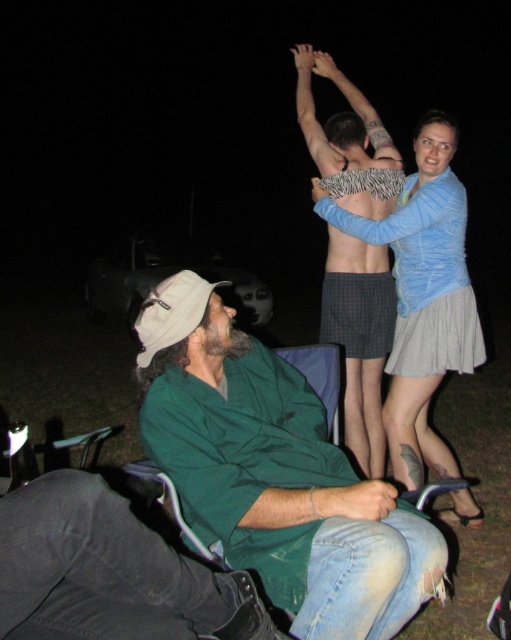
Measure the distance between green cotton shirt at lower left and camera.

They are 5.44 feet apart.

You are a GUI agent. You are given a task and a screenshot of the screen. Output one action in this format:
    pyautogui.click(x=<x>, y=<y>)
    Task: Click on the green cotton shirt at lower left
    This screenshot has height=640, width=511.
    Given the screenshot: What is the action you would take?
    pyautogui.click(x=274, y=474)

Does point (259, 397) come closer to viewer compared to point (352, 218)?

Yes, point (259, 397) is closer to viewer.

Image resolution: width=511 pixels, height=640 pixels. In order to click on green cotton shirt at lower left in this screenshot , I will do `click(274, 474)`.

Is green cotton shirt at lower left in front of zebra-patterned fabric at center?

Yes, green cotton shirt at lower left is closer to the viewer.

Is green cotton shirt at lower left smaller than zebra-patterned fabric at center?

No.

You are a GUI agent. You are given a task and a screenshot of the screen. Output one action in this format:
    pyautogui.click(x=<x>, y=<y>)
    Task: Click on the green cotton shirt at lower left
    
    Given the screenshot: What is the action you would take?
    pyautogui.click(x=274, y=474)

Is light blue fabric skirt at upper right above zebra print arm at upper center?

No, light blue fabric skirt at upper right is not above zebra print arm at upper center.

Who is positioned more to the right, light blue fabric skirt at upper right or zebra print arm at upper center?

Positioned to the right is light blue fabric skirt at upper right.

This screenshot has height=640, width=511. Find the location of `light blue fabric skirt at upper right`. light blue fabric skirt at upper right is located at coordinates (424, 296).

This screenshot has width=511, height=640. What are the coordinates of `light blue fabric skirt at upper right` in the screenshot? It's located at (424, 296).